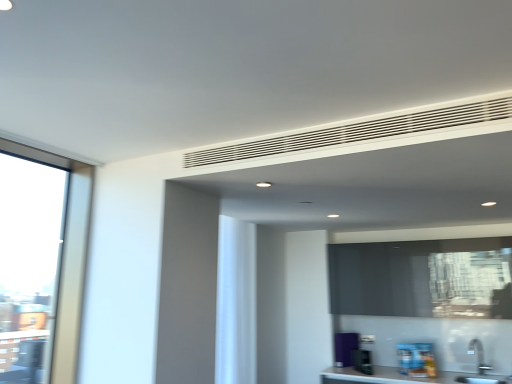
The image size is (512, 384). What are the coordinates of `black matte window screen at center` in the screenshot? It's located at (423, 278).

This screenshot has width=512, height=384. What do you see at coordinates (362, 361) in the screenshot?
I see `green plastic toaster at lower center, the second appliance in the right-to-left sequence` at bounding box center [362, 361].

Where is `white matte vent at upper center`? This screenshot has width=512, height=384. white matte vent at upper center is located at coordinates (357, 132).

Describe the element at coordinates (357, 132) in the screenshot. Image resolution: width=512 pixels, height=384 pixels. I see `white matte vent at upper center` at that location.

Identify the location of black matte window screen at center. (423, 278).

Do you think purple matte refrigerator at lower right, which ranks as the 3th appliance in right-to-left order, is within green plastic toaster at lower center, marked as the second appliance in a front-to-back arrangement, or outside of it?

purple matte refrigerator at lower right, which ranks as the 3th appliance in right-to-left order, cannot be found inside green plastic toaster at lower center, marked as the second appliance in a front-to-back arrangement.

From a real-world perspective, does purple matte refrigerator at lower right, which is the first appliance from left to right, stand above green plastic toaster at lower center, marked as the second appliance in a front-to-back arrangement?

Yes.

Considering the relative sizes of purple matte refrigerator at lower right, which ranks as the 3th appliance in right-to-left order, and green plastic toaster at lower center, the second appliance in the right-to-left sequence, in the image provided, is purple matte refrigerator at lower right, which ranks as the 3th appliance in right-to-left order, smaller than green plastic toaster at lower center, the second appliance in the right-to-left sequence,?

Incorrect, purple matte refrigerator at lower right, which ranks as the 3th appliance in right-to-left order, is not smaller in size than green plastic toaster at lower center, the second appliance in the right-to-left sequence.

Considering the relative positions of purple matte refrigerator at lower right, which ranks as the 3th appliance in right-to-left order, and green plastic toaster at lower center, marked as the second appliance in a front-to-back arrangement, in the image provided, is purple matte refrigerator at lower right, which ranks as the 3th appliance in right-to-left order, behind green plastic toaster at lower center, marked as the second appliance in a front-to-back arrangement,?

Yes.

From their relative heights in the image, would you say black matte window screen at center is taller or shorter than white matte curtain at center?

Clearly, black matte window screen at center is shorter compared to white matte curtain at center.

Does black matte window screen at center have a smaller size compared to white matte curtain at center?

No, black matte window screen at center is not smaller than white matte curtain at center.

Can you tell me how much black matte window screen at center and white matte curtain at center differ in facing direction?

The facing directions of black matte window screen at center and white matte curtain at center are 89.8 degrees apart.

Is black matte window screen at center behind white matte curtain at center?

That is False.

From the image's perspective, which object appears higher, purple matte refrigerator at lower right, marked as the 3th appliance in a front-to-back arrangement, or blue glossy book at lower right, which is the first appliance from front to back?

blue glossy book at lower right, which is the first appliance from front to back.

Is blue glossy book at lower right, the 3th appliance viewed from the left, at the back of purple matte refrigerator at lower right, which ranks as the 3th appliance in right-to-left order?

purple matte refrigerator at lower right, which ranks as the 3th appliance in right-to-left order, is not turned away from blue glossy book at lower right, the 3th appliance viewed from the left.

Is blue glossy book at lower right, placed as the third appliance when sorted from back to front, located within green plastic toaster at lower center, acting as the 2th appliance starting from the left?

No, blue glossy book at lower right, placed as the third appliance when sorted from back to front, is located outside of green plastic toaster at lower center, acting as the 2th appliance starting from the left.

Between green plastic toaster at lower center, positioned as the 2th appliance in back-to-front order, and blue glossy book at lower right, the 3th appliance viewed from the left, which one appears on the left side from the viewer's perspective?

green plastic toaster at lower center, positioned as the 2th appliance in back-to-front order.

From a real-world perspective, between green plastic toaster at lower center, acting as the 2th appliance starting from the left, and blue glossy book at lower right, which is the 1th appliance from right to left, who is vertically lower?

From a 3D spatial view, green plastic toaster at lower center, acting as the 2th appliance starting from the left, is below.

From the image's perspective, is green plastic toaster at lower center, acting as the 2th appliance starting from the left, below blue glossy book at lower right, the 3th appliance viewed from the left?

Correct, green plastic toaster at lower center, acting as the 2th appliance starting from the left, appears lower than blue glossy book at lower right, the 3th appliance viewed from the left, in the image.

From a real-world perspective, which object stands above the other?

In real-world perspective, white matte vent at upper center is above.

Considering the sizes of objects white matte vent at upper center and black matte window screen at center in the image provided, who is taller, white matte vent at upper center or black matte window screen at center?

With more height is black matte window screen at center.

From the image's perspective, does white matte vent at upper center appear higher than black matte window screen at center?

Correct, white matte vent at upper center appears higher than black matte window screen at center in the image.

Would you say black matte window screen at center is part of white matte vent at upper center's contents?

No, black matte window screen at center is not surrounded by white matte vent at upper center.

Between purple matte refrigerator at lower right, which ranks as the 3th appliance in right-to-left order, and white matte curtain at center, which one has more height?

white matte curtain at center is taller.

Is purple matte refrigerator at lower right, which ranks as the 3th appliance in right-to-left order, spatially inside white matte curtain at center, or outside of it?

purple matte refrigerator at lower right, which ranks as the 3th appliance in right-to-left order, lies outside white matte curtain at center.

Can you confirm if purple matte refrigerator at lower right, marked as the 3th appliance in a front-to-back arrangement, is wider than white matte curtain at center?

Correct, the width of purple matte refrigerator at lower right, marked as the 3th appliance in a front-to-back arrangement, exceeds that of white matte curtain at center.

Considering the sizes of objects blue glossy book at lower right, which is the 1th appliance from right to left, and green plastic toaster at lower center, marked as the second appliance in a front-to-back arrangement, in the image provided, who is shorter, blue glossy book at lower right, which is the 1th appliance from right to left, or green plastic toaster at lower center, marked as the second appliance in a front-to-back arrangement,?

green plastic toaster at lower center, marked as the second appliance in a front-to-back arrangement.

Is blue glossy book at lower right, placed as the third appliance when sorted from back to front, oriented towards green plastic toaster at lower center, positioned as the 2th appliance in back-to-front order?

No, blue glossy book at lower right, placed as the third appliance when sorted from back to front, is not aimed at green plastic toaster at lower center, positioned as the 2th appliance in back-to-front order.

In the image, is blue glossy book at lower right, placed as the third appliance when sorted from back to front, positioned in front of or behind green plastic toaster at lower center, marked as the second appliance in a front-to-back arrangement?

blue glossy book at lower right, placed as the third appliance when sorted from back to front, is positioned closer to the viewer than green plastic toaster at lower center, marked as the second appliance in a front-to-back arrangement.

Find the location of a particular element. This screenshot has height=384, width=512. the 1st appliance in front when counting from the purple matte refrigerator at lower right, marked as the 3th appliance in a front-to-back arrangement is located at coordinates (x=362, y=361).

This screenshot has width=512, height=384. In order to click on window screen on the right of white matte curtain at center in this screenshot , I will do `click(423, 278)`.

Based on their spatial positions, is white matte curtain at center or black matte window screen at center further from blue glossy book at lower right, the 3th appliance viewed from the left?

white matte curtain at center is further to blue glossy book at lower right, the 3th appliance viewed from the left.

Based on their spatial positions, is white matte vent at upper center or purple matte refrigerator at lower right, which is counted as the 1th appliance, starting from the back, further from black matte window screen at center?

The object further to black matte window screen at center is white matte vent at upper center.

Estimate the real-world distances between objects in this image. Which object is closer to black matte window screen at center, purple matte refrigerator at lower right, which is counted as the 1th appliance, starting from the back, or white matte curtain at center?

The object closer to black matte window screen at center is purple matte refrigerator at lower right, which is counted as the 1th appliance, starting from the back.

Looking at the image, which one is located further to white matte vent at upper center, black matte window screen at center or blue glossy book at lower right, which is the 1th appliance from right to left?

blue glossy book at lower right, which is the 1th appliance from right to left.

Based on their spatial positions, is blue glossy book at lower right, the 3th appliance viewed from the left, or white matte vent at upper center closer to black matte window screen at center?

Among the two, blue glossy book at lower right, the 3th appliance viewed from the left, is located nearer to black matte window screen at center.

Considering their positions, is purple matte refrigerator at lower right, which ranks as the 3th appliance in right-to-left order, positioned closer to green plastic toaster at lower center, marked as the second appliance in a front-to-back arrangement, than white matte vent at upper center?

purple matte refrigerator at lower right, which ranks as the 3th appliance in right-to-left order, is closer to green plastic toaster at lower center, marked as the second appliance in a front-to-back arrangement.

Looking at the image, which one is located further to white matte curtain at center, white matte vent at upper center or green plastic toaster at lower center, acting as the 2th appliance starting from the left?

white matte vent at upper center lies further to white matte curtain at center than the other object.

Considering their positions, is black matte window screen at center positioned further to white matte vent at upper center than white matte curtain at center?

Based on the image, black matte window screen at center appears to be further to white matte vent at upper center.

Find the location of a particular element. The image size is (512, 384). curtain positioned between white matte vent at upper center and green plastic toaster at lower center, positioned as the 2th appliance in back-to-front order, from near to far is located at coordinates (236, 302).

Image resolution: width=512 pixels, height=384 pixels. Identify the location of window screen positioned between white matte vent at upper center and white matte curtain at center from near to far. (423, 278).

Find the location of a particular element. The height and width of the screenshot is (384, 512). curtain located between white matte vent at upper center and blue glossy book at lower right, the 3th appliance viewed from the left, in the depth direction is located at coordinates (236, 302).

I want to click on appliance situated between purple matte refrigerator at lower right, marked as the 3th appliance in a front-to-back arrangement, and blue glossy book at lower right, placed as the third appliance when sorted from back to front, from left to right, so click(362, 361).